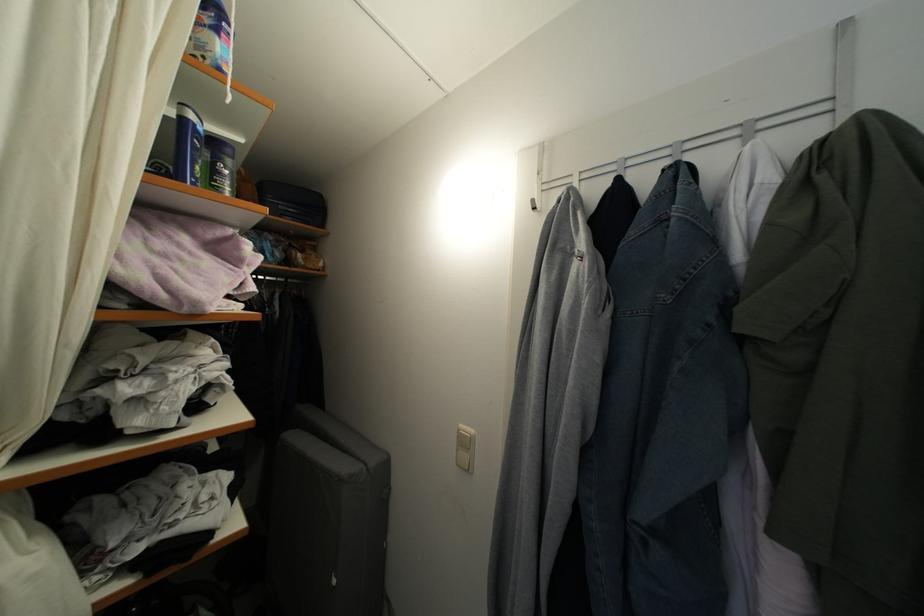
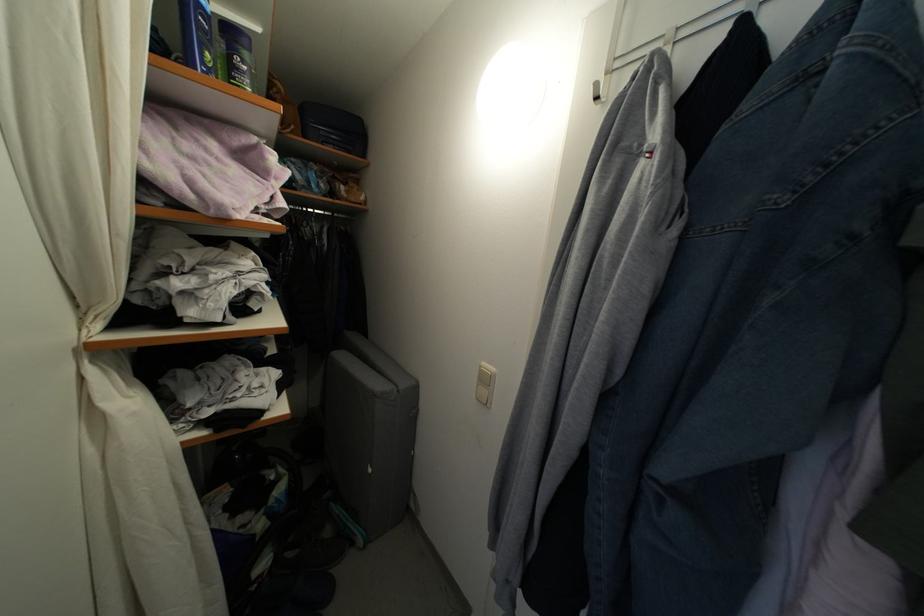
Where in the second image is the point corresponding to point (286, 214) from the first image?

(327, 139)